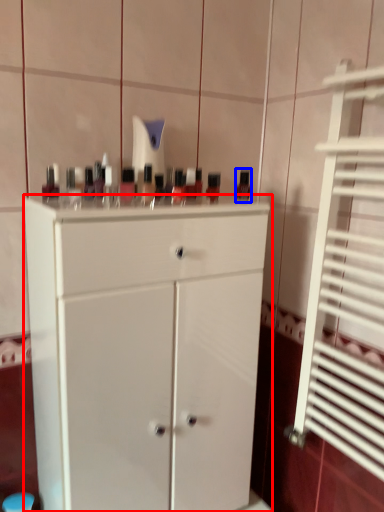
Question: Which point is closer to the camera, chest of drawers (highlighted by a red box) or mouthwash (highlighted by a blue box)?

Choices:
 (A) chest of drawers
 (B) mouthwash

Answer: (A)